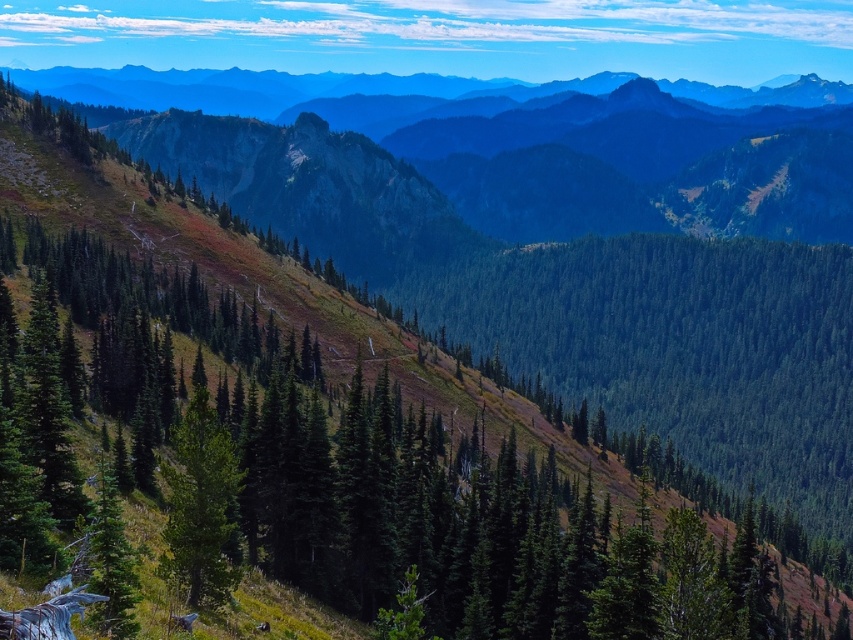
Question: Estimate the real-world distances between objects in this image. Which object is farther from the green matte tree at center?

Choices:
 (A) green forested mountain range at upper center
 (B) green textured trees at center

Answer: (A)

Question: Among these objects, which one is farthest from the camera?

Choices:
 (A) green matte tree at center
 (B) green textured trees at center
 (C) green forested mountain range at upper center

Answer: (C)

Question: Does green textured trees at center have a larger size compared to green matte tree at center?

Choices:
 (A) no
 (B) yes

Answer: (B)

Question: Is green textured trees at center behind green forested mountain range at upper center?

Choices:
 (A) no
 (B) yes

Answer: (A)

Question: Which of the following is the farthest from the observer?

Choices:
 (A) (473, 458)
 (B) (195, 522)

Answer: (A)

Question: In this image, where is green textured trees at center located relative to green forested mountain range at upper center?

Choices:
 (A) right
 (B) left

Answer: (B)